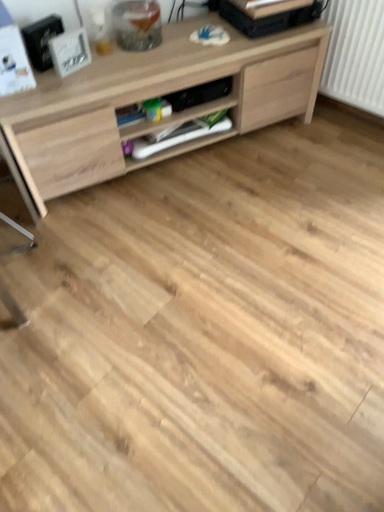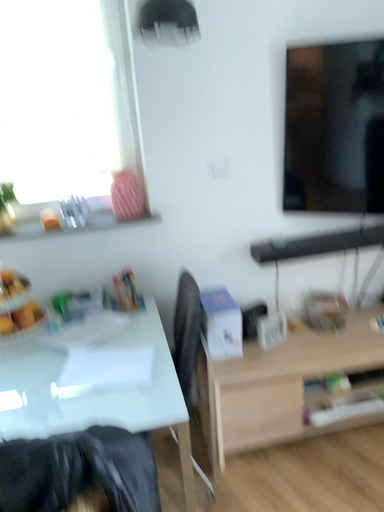
Question: How did the camera likely rotate when shooting the video?

Choices:
 (A) rotated right
 (B) rotated left

Answer: (B)